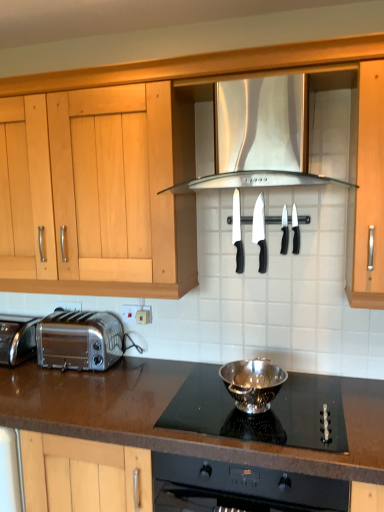
This screenshot has width=384, height=512. In order to click on space that is in front of polished chrome toaster at lower left in this screenshot , I will do `click(63, 397)`.